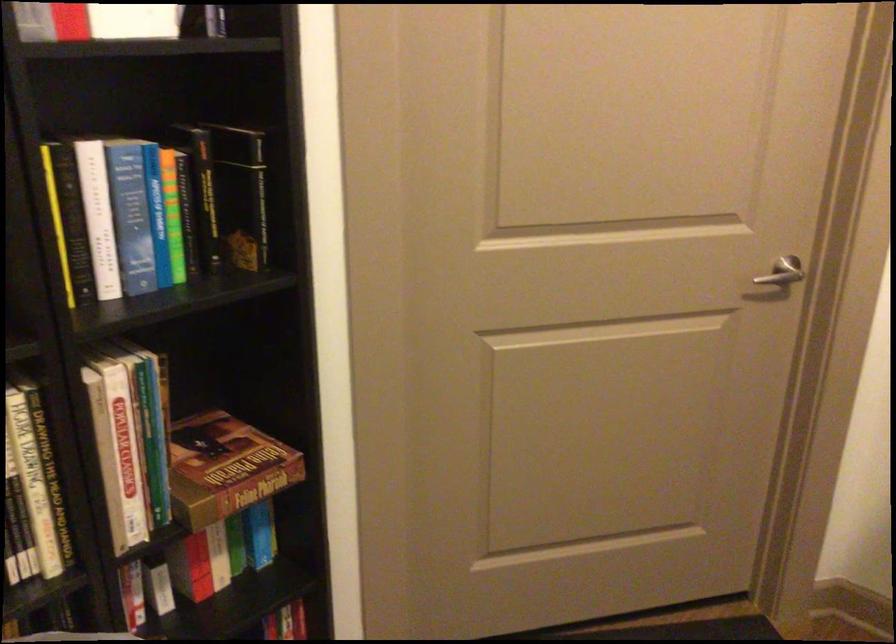
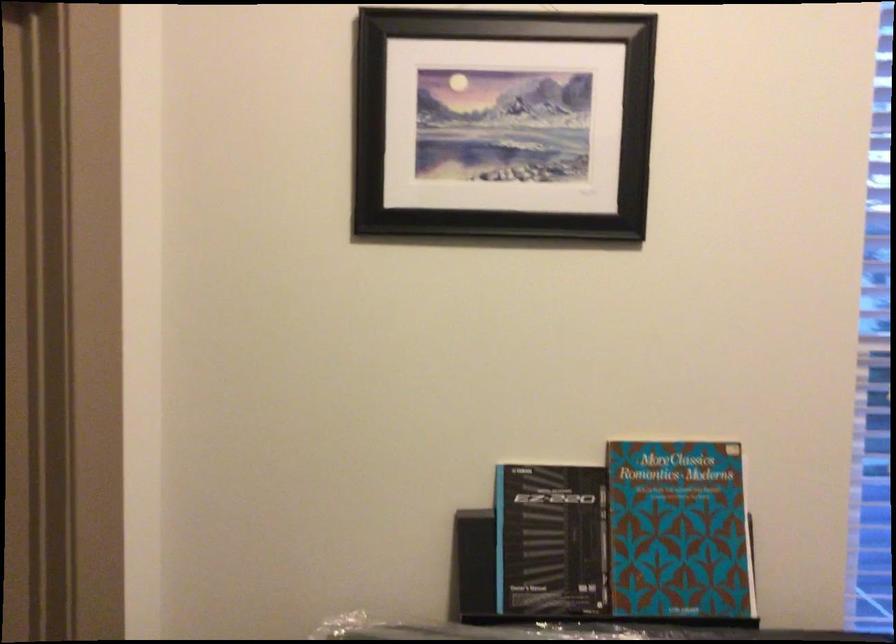
Question: The camera is either moving clockwise (left) or counter-clockwise (right) around the object. The first image is from the beginning of the video and the second image is from the end. Is the camera moving left or right when shooting the video?

Choices:
 (A) Left
 (B) Right

Answer: (A)